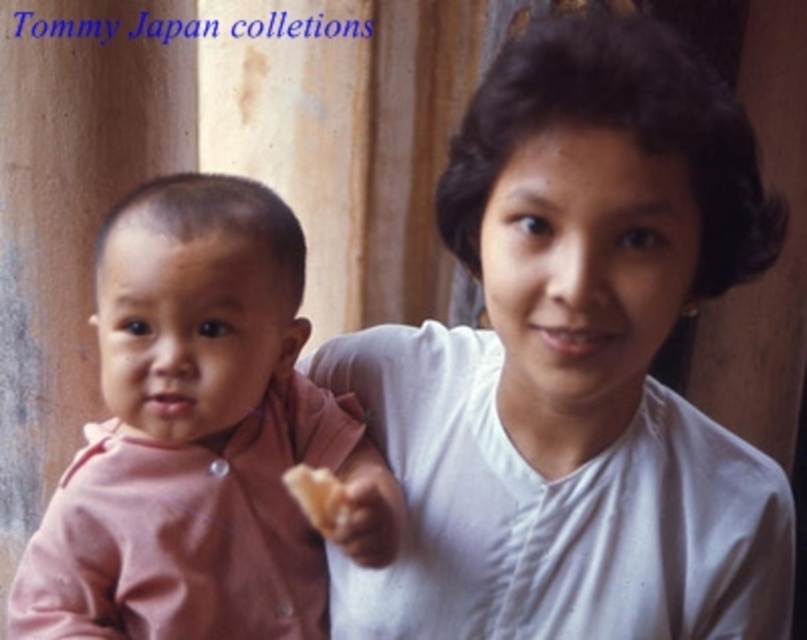
Question: Does white matte shirt at upper right come in front of white crumbly bread at center?

Choices:
 (A) no
 (B) yes

Answer: (B)

Question: Is the position of white matte shirt at upper right more distant than that of white crumbly bread at center?

Choices:
 (A) yes
 (B) no

Answer: (B)

Question: Among these points, which one is farthest from the camera?

Choices:
 (A) (632, 120)
 (B) (178, 316)
 (C) (312, 522)

Answer: (C)

Question: Which point is farther from the camera taking this photo?

Choices:
 (A) (x=260, y=584)
 (B) (x=792, y=568)

Answer: (A)

Question: In this image, where is pink fabric baby at center located relative to white crumbly bread at center?

Choices:
 (A) left
 (B) right

Answer: (A)

Question: Which of these objects is positioned closest to the pink fabric baby at center?

Choices:
 (A) white crumbly bread at center
 (B) white matte shirt at upper right

Answer: (A)